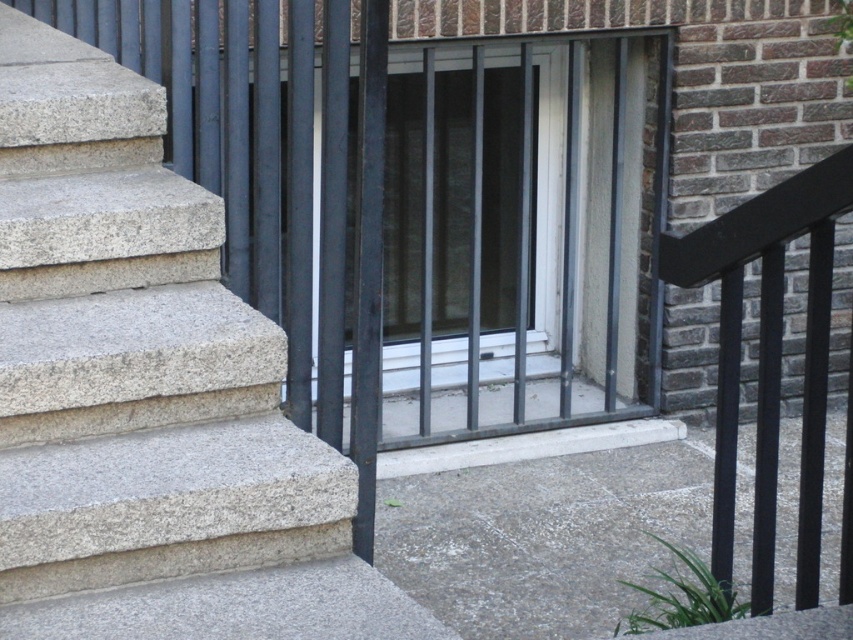
Is point (3, 577) less distant than point (735, 307)?

Yes.

Between point (33, 248) and point (730, 250), which one is positioned behind?

Point (33, 248)

Locate an element on the screen. This screenshot has height=640, width=853. smooth concrete steps at left is located at coordinates (148, 392).

Between point (213, 499) and point (473, 179), which one is positioned behind?

The point (473, 179) is behind.

Is smooth concrete steps at left wider than clear glass door at center?

Indeed, smooth concrete steps at left has a greater width compared to clear glass door at center.

Which is in front, point (154, 365) or point (450, 76)?

Point (154, 365)

Locate an element on the screen. smooth concrete steps at left is located at coordinates (148, 392).

This screenshot has width=853, height=640. What are the coordinates of `clear glass door at center` in the screenshot? It's located at (517, 237).

Where is `clear glass door at center`? The height and width of the screenshot is (640, 853). clear glass door at center is located at coordinates (517, 237).